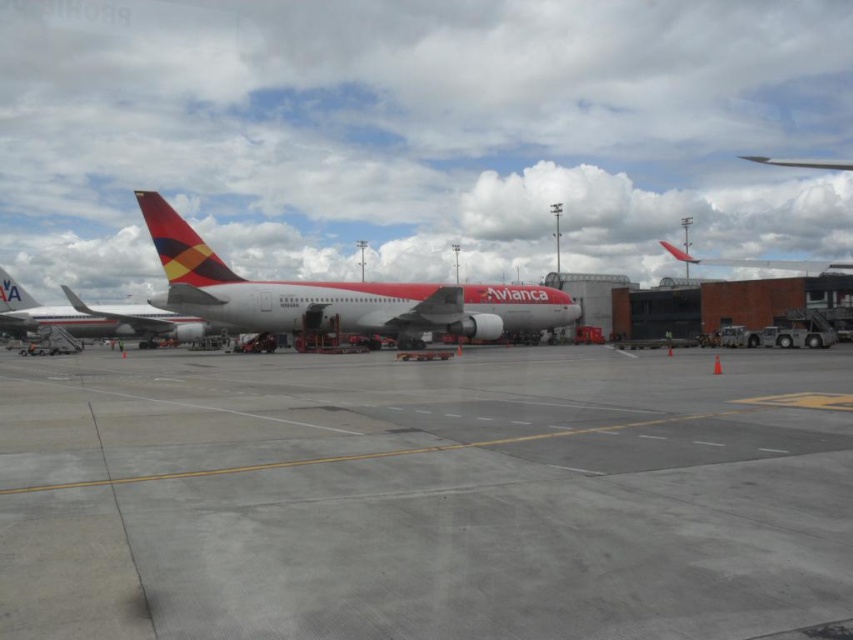
You are a pilot taxiing an aircraft on the airport tarmac. You need to reach a gate located at point (x=425, y=496). The Avianca aircraft is parked at its gate. Can you safely navigate your aircraft to the gate without crossing the yellow lines?

The gray concrete tarmac at center is located at point (x=425, y=496), so yes, you can safely navigate your aircraft to the gate without crossing the yellow lines as the tarmac provides a designated path.

What is the location of the gray concrete tarmac at center in the image?

The gray concrete tarmac at center is located at point (425, 496).